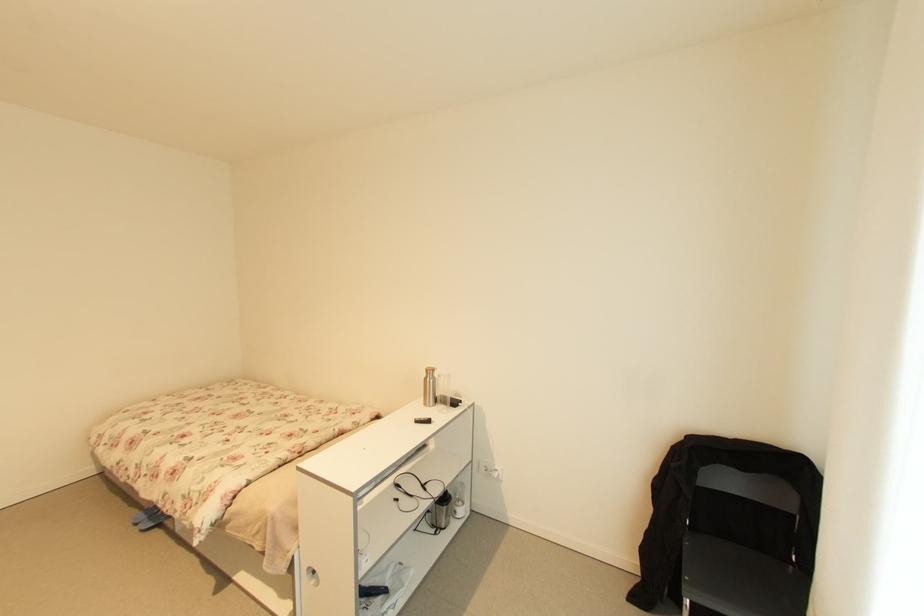
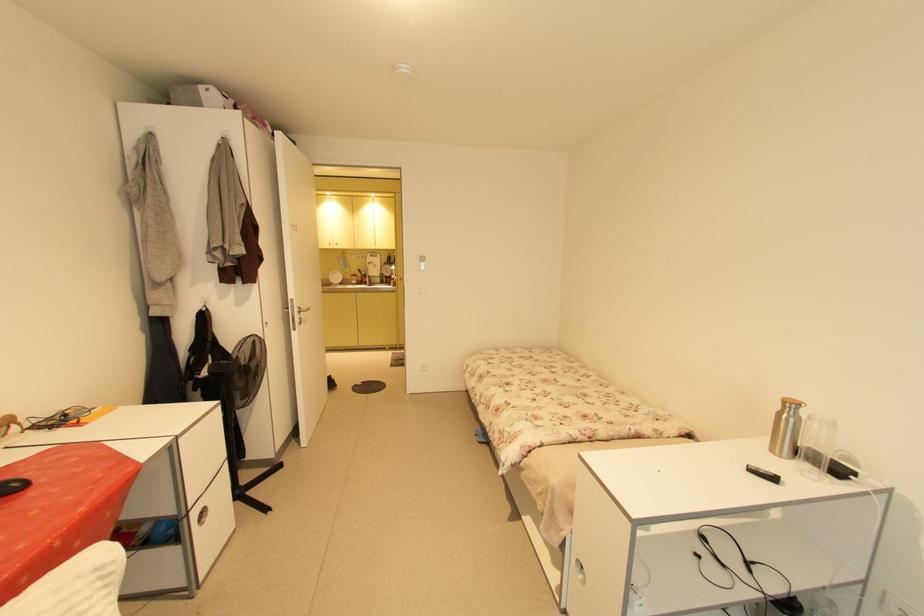
Question: The camera is either moving clockwise (left) or counter-clockwise (right) around the object. The first image is from the beginning of the video and the second image is from the end. Is the camera moving left or right when shooting the video?

Choices:
 (A) Left
 (B) Right

Answer: (B)